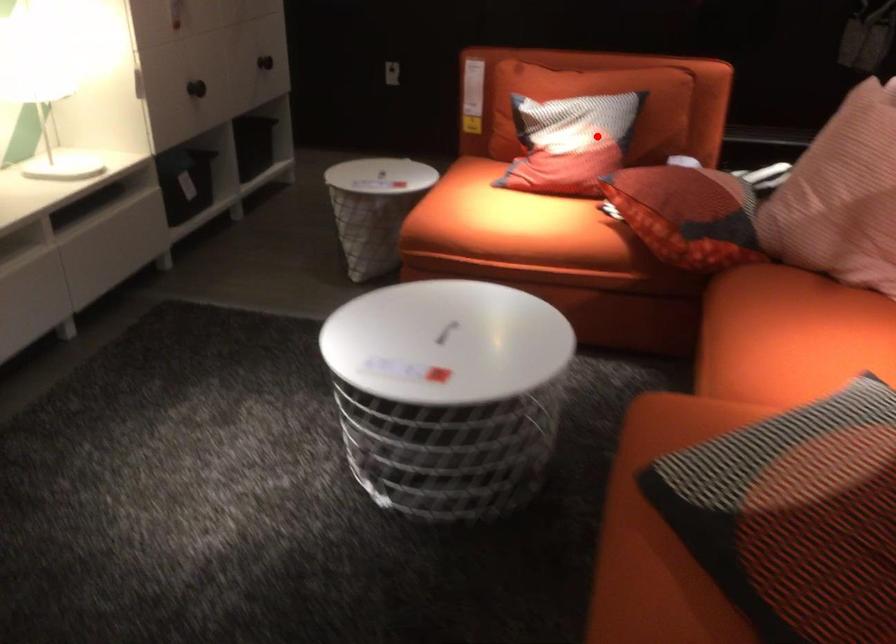
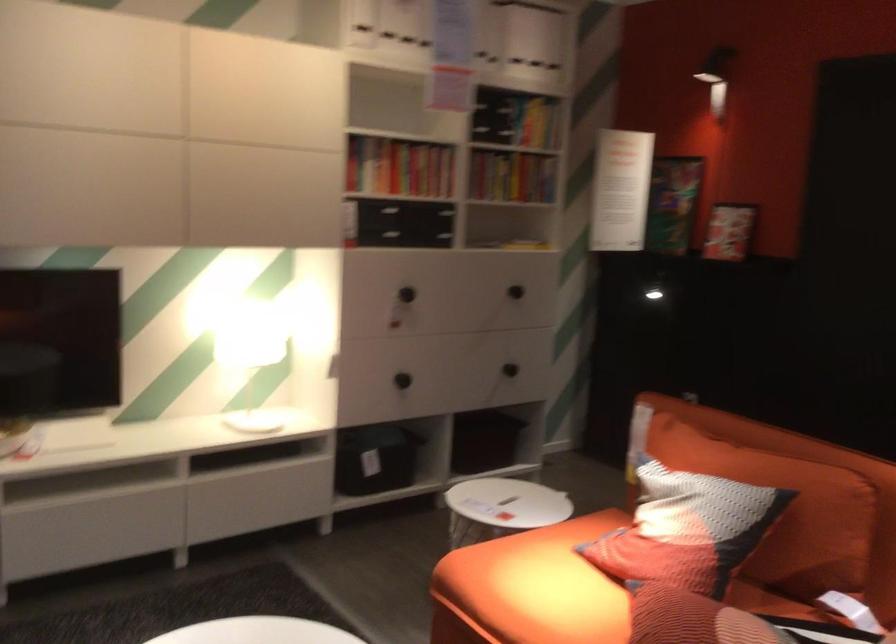
Question: I am providing you with two images of the same scene from different viewpoints. In image1, a red point is highlighted. Considering the same 3D point in image2, which of the following is correct?

Choices:
 (A) It is closer
 (B) It is farther

Answer: (A)